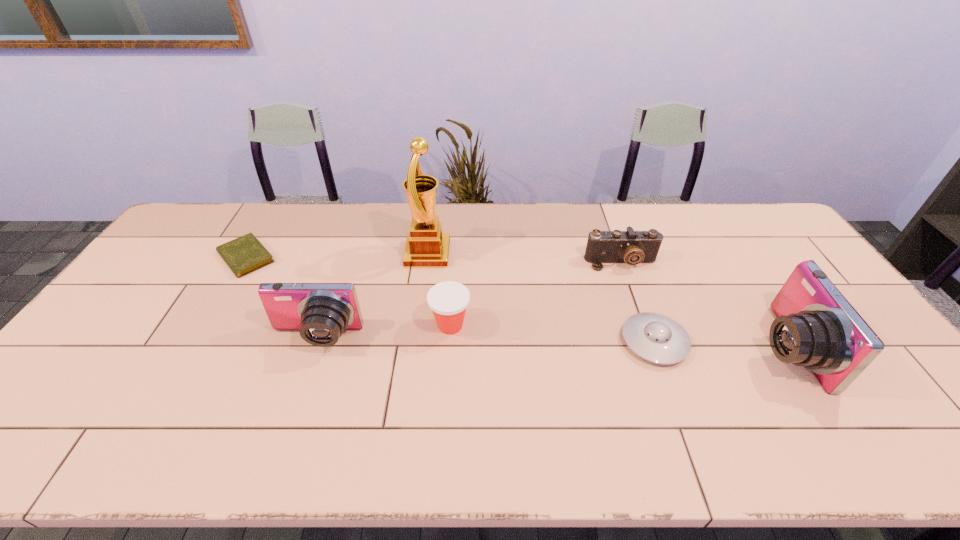
Find the location of a particular element. This screenshot has height=540, width=960. diary at the far edge is located at coordinates (243, 255).

The width and height of the screenshot is (960, 540). Find the location of `award that is at the far edge`. award that is at the far edge is located at coordinates (426, 246).

Image resolution: width=960 pixels, height=540 pixels. Find the location of `object that is at the near edge`. object that is at the near edge is located at coordinates (816, 327).

Find the location of a particular element. The height and width of the screenshot is (540, 960). vacant region at the far edge of the desktop is located at coordinates (663, 235).

Find the location of a particular element. The height and width of the screenshot is (540, 960). vacant space at the near edge of the desktop is located at coordinates (374, 414).

Where is `vacant space at the right edge of the desktop`? vacant space at the right edge of the desktop is located at coordinates (871, 377).

Where is `vacant space at the far left corner`? vacant space at the far left corner is located at coordinates pyautogui.click(x=179, y=240).

Where is `blank region between the sixth tallest object and the Dixie cup`? The image size is (960, 540). blank region between the sixth tallest object and the Dixie cup is located at coordinates (552, 333).

At what (x,y) coordinates should I click in order to perform the action: click on free area in between the shortest camera and the Dixie cup. Please return your answer as a coordinate pair (x, y). Image resolution: width=960 pixels, height=540 pixels. Looking at the image, I should click on (536, 294).

You are a GUI agent. You are given a task and a screenshot of the screen. Output one action in this format:
    pyautogui.click(x=<x>, y=<y>)
    Task: Click on the blank region between the Dixie cup and the saucer
    The width and height of the screenshot is (960, 540).
    Given the screenshot: What is the action you would take?
    pyautogui.click(x=552, y=333)